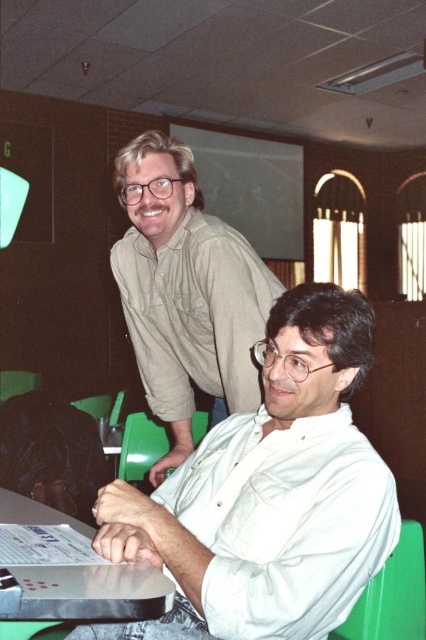
From the picture: You are a photographer setting up a shot in this classroom scene. You need to ensure that the light brown shirt at upper center and the green plastic chair at lower center are both in frame. Considering their sizes, which object should you zoom in on to include both without cropping either?

The light brown shirt at upper center is wider than the green plastic chair at lower center, so you should zoom in on the green plastic chair at lower center to include both without cropping either.

Consider the image. You are a student sitting in the green plastic chair at lower center and want to hand a paper to the person wearing the light brown shirt at upper center. Can you reach them without leaving your seat?

The light brown shirt at upper center and green plastic chair at lower center are 39.30 inches apart. Since the distance between them is about 39.30 inches, you can likely reach the person by stretching your arm out, as the distance is within a typical arm span.